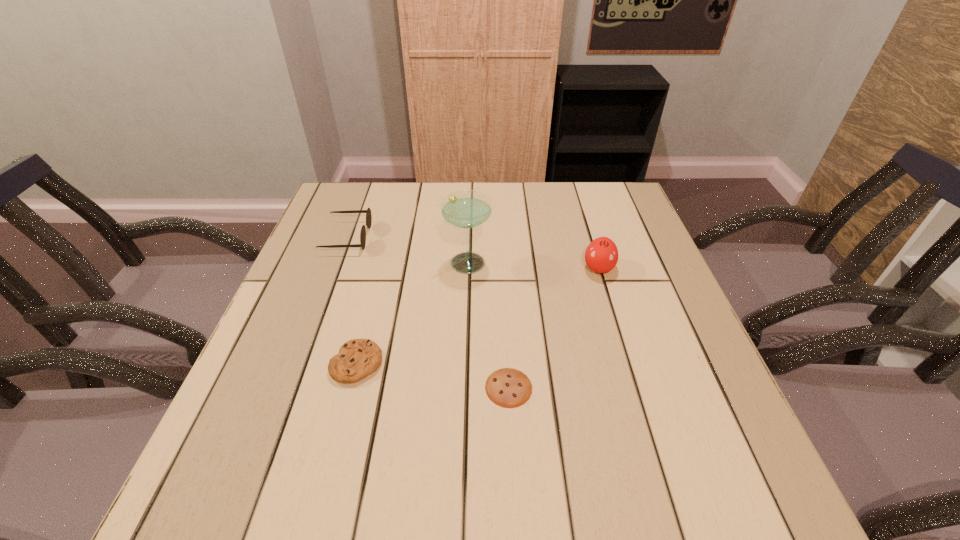
Identify the location of free space located 0.390m on the left of the rightmost object. The height and width of the screenshot is (540, 960). (429, 268).

Find the location of a particular element. The width and height of the screenshot is (960, 540). vacant space located 0.220m on the front-facing side of the leftmost object is located at coordinates (448, 238).

Identify the location of free space located on the right of the fourth object from right to left. The height and width of the screenshot is (540, 960). (554, 363).

Image resolution: width=960 pixels, height=540 pixels. Find the location of `free location located 0.160m on the right of the shorter cookie`. free location located 0.160m on the right of the shorter cookie is located at coordinates (614, 388).

Identify the location of object that is at the far edge. (368, 212).

Identify the location of sunglasses at the left edge. This screenshot has width=960, height=540. point(368,212).

Where is `cookie present at the left edge`? This screenshot has width=960, height=540. cookie present at the left edge is located at coordinates (357, 358).

What are the coordinates of `object that is at the right edge` in the screenshot? It's located at (601, 256).

This screenshot has width=960, height=540. What are the coordinates of `object at the far left corner` in the screenshot? It's located at (368, 212).

Identify the location of vacant point at the far edge. Image resolution: width=960 pixels, height=540 pixels. (536, 213).